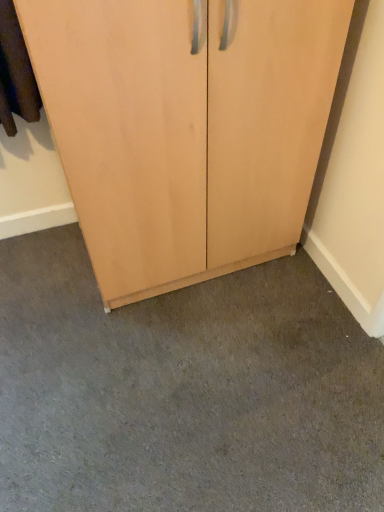
Question: Would you say gray carpet at lower center is inside or outside light wood cupboard at center?

Choices:
 (A) outside
 (B) inside

Answer: (A)

Question: Does point (231, 289) appear closer or farther from the camera than point (279, 114)?

Choices:
 (A) farther
 (B) closer

Answer: (A)

Question: From their relative heights in the image, would you say gray carpet at lower center is taller or shorter than light wood cupboard at center?

Choices:
 (A) tall
 (B) short

Answer: (B)

Question: Relative to gray carpet at lower center, is light wood cupboard at center in front or behind?

Choices:
 (A) front
 (B) behind

Answer: (A)

Question: Is light wood cupboard at center taller or shorter than gray carpet at lower center?

Choices:
 (A) tall
 (B) short

Answer: (A)

Question: Looking at their shapes, would you say light wood cupboard at center is wider or thinner than gray carpet at lower center?

Choices:
 (A) wide
 (B) thin

Answer: (B)

Question: Based on their positions, is light wood cupboard at center located to the left or right of gray carpet at lower center?

Choices:
 (A) left
 (B) right

Answer: (A)